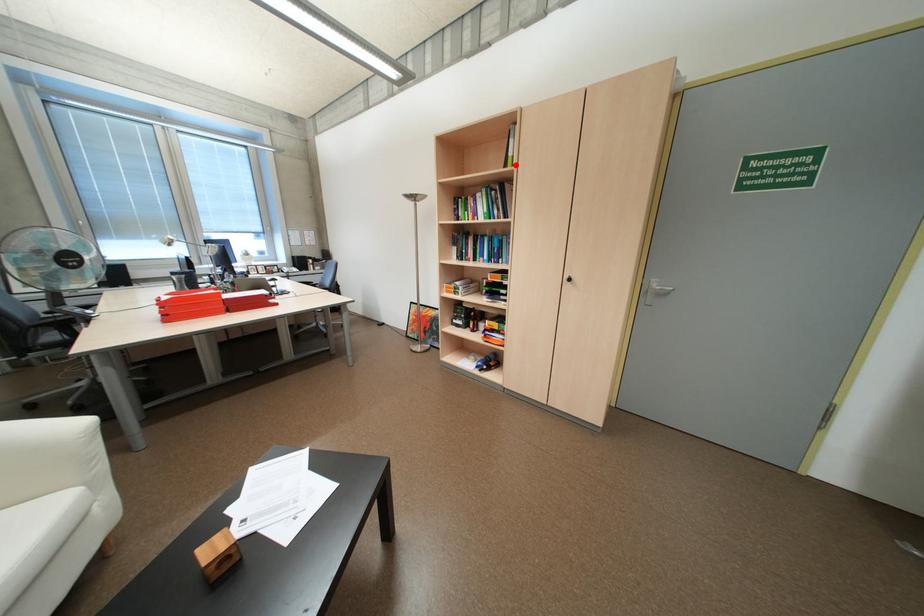
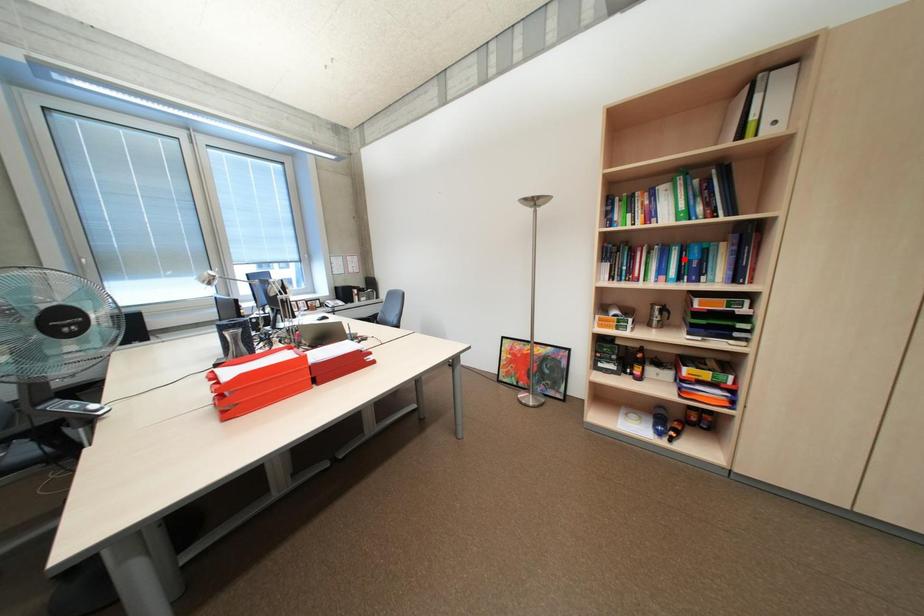
I am providing you with two images of the same scene from different viewpoints. A red point is marked on the first image and another point is marked on the second image. Does the point marked in image1 correspond to the same location as the one in image2?

No